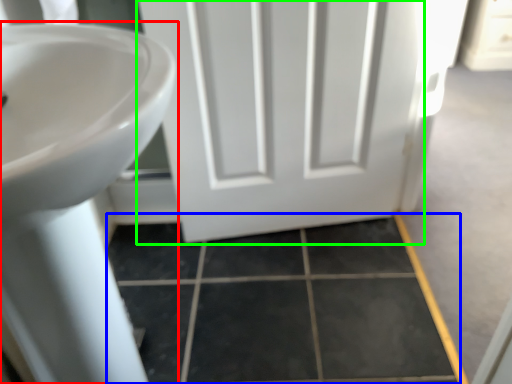
Question: Based on their relative distances, which object is farther from sink (highlighted by a red box)? Choose from tile (highlighted by a blue box) and door (highlighted by a green box).

Choices:
 (A) tile
 (B) door

Answer: (B)